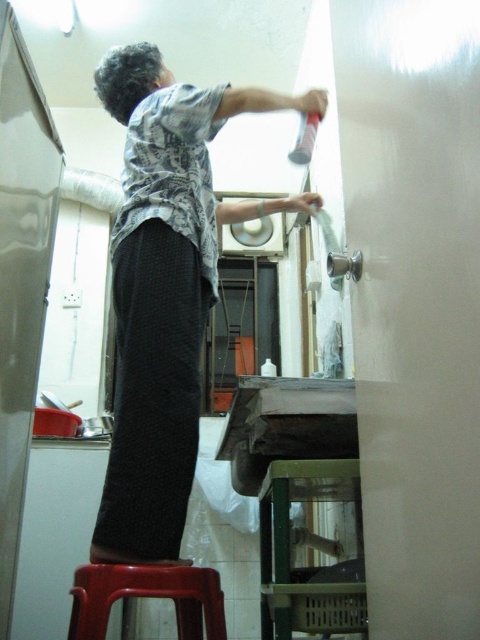
Question: Is gray cotton shirt at upper center closer to the viewer compared to plastic stool at lower left?

Choices:
 (A) no
 (B) yes

Answer: (A)

Question: Which object appears farthest from the camera in this image?

Choices:
 (A) plastic stool at lower left
 (B) gray cotton shirt at upper center

Answer: (B)

Question: Among these points, which one is nearest to the camera?

Choices:
 (A) (111, 573)
 (B) (261, 104)

Answer: (A)

Question: Does gray cotton shirt at upper center have a smaller size compared to plastic stool at lower left?

Choices:
 (A) yes
 (B) no

Answer: (B)

Question: Can you confirm if gray cotton shirt at upper center is wider than plastic stool at lower left?

Choices:
 (A) no
 (B) yes

Answer: (B)